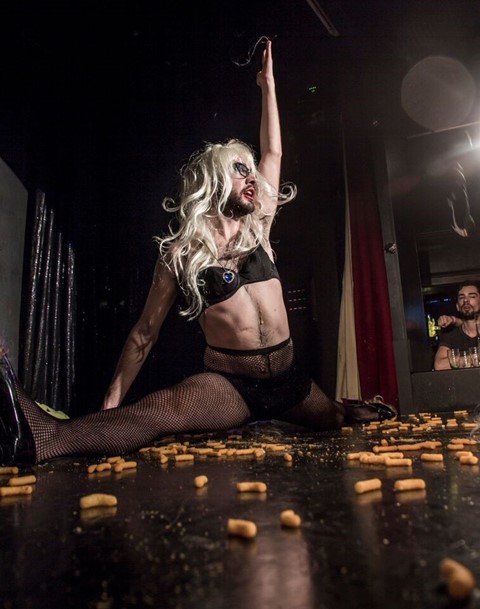
The height and width of the screenshot is (609, 480). In order to click on floor in this screenshot , I will do `click(250, 583)`.